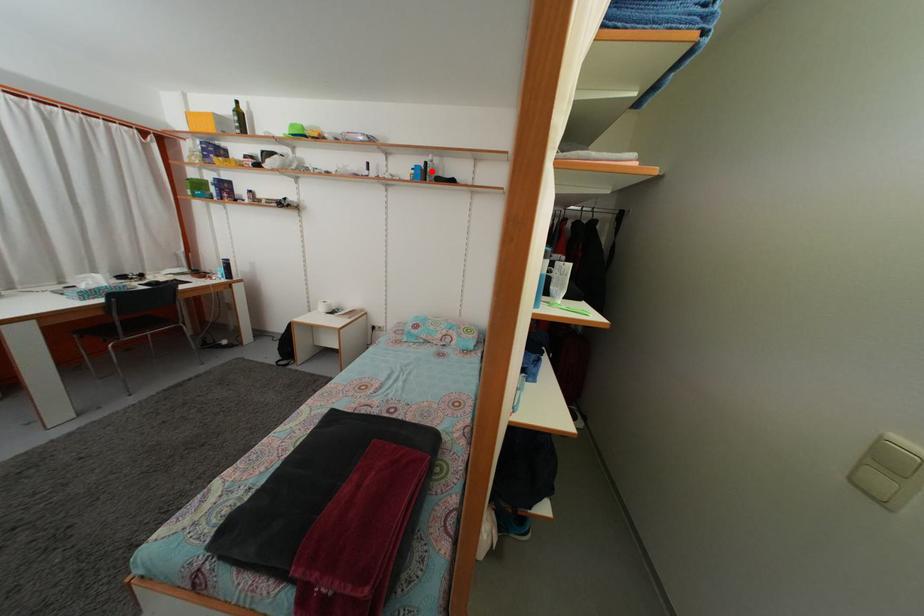
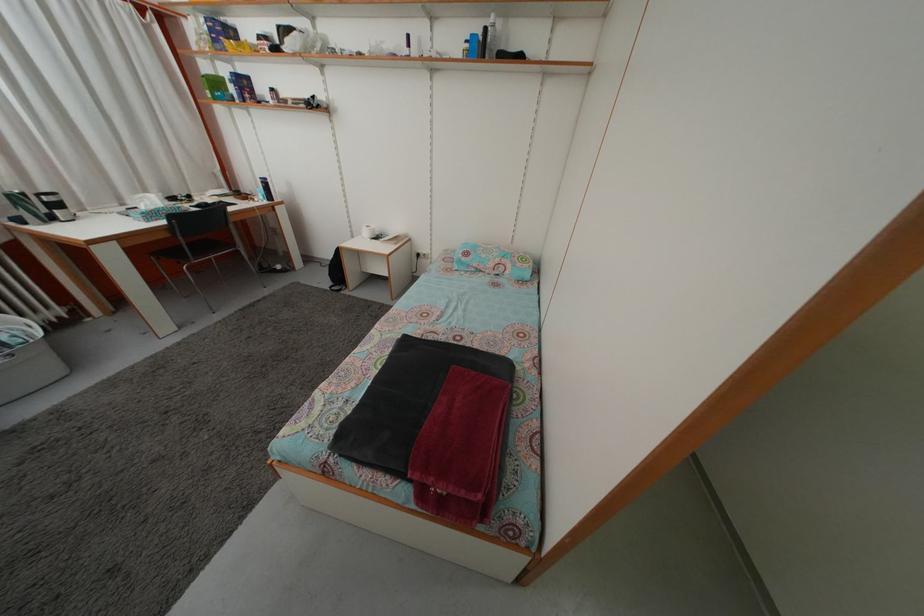
The point at the highlighted location is marked in the first image. Where is the corresponding point in the second image?

(492, 38)